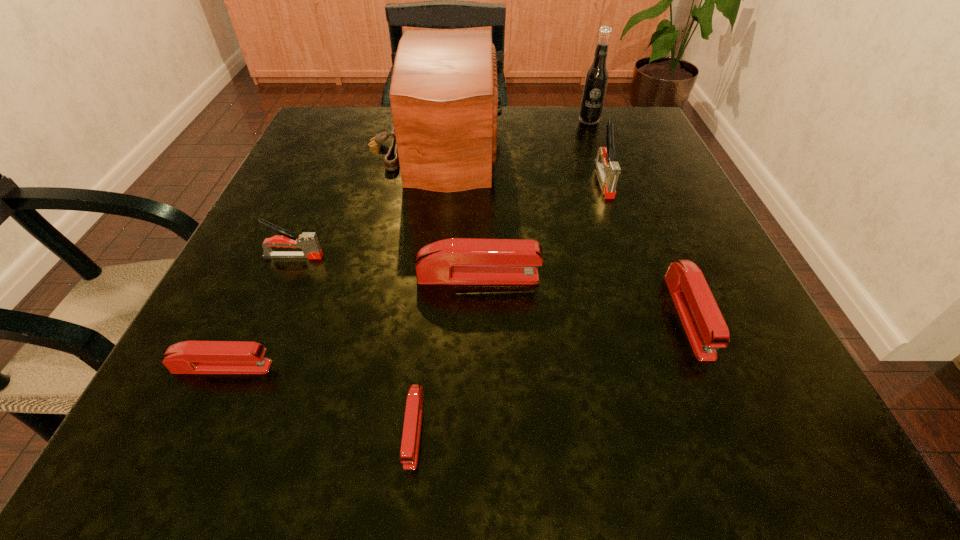
The height and width of the screenshot is (540, 960). Find the location of `vacant space that is in between the leftmost red stapler and the tallest stapler`. vacant space that is in between the leftmost red stapler and the tallest stapler is located at coordinates (413, 273).

Identify which object is the fourth nearest to the root beer. Please provide its 2D coordinates. Your answer should be formatted as a tuple, i.e. [(x, y)], where the tuple contains the x and y coordinates of a point satisfying the conditions above.

[(456, 260)]

This screenshot has height=540, width=960. I want to click on object that ranks as the closest to the radio receiver, so click(x=307, y=241).

Image resolution: width=960 pixels, height=540 pixels. What are the coordinates of `the third closest stapler to the third shortest stapler` in the screenshot? It's located at (409, 451).

Locate which stapler is the third closest to the seventh tallest object. Please provide its 2D coordinates. Your answer should be formatted as a tuple, i.e. [(x, y)], where the tuple contains the x and y coordinates of a point satisfying the conditions above.

[(456, 260)]

Locate an element on the screen. the second closest red stapler to the smaller gray stapler is located at coordinates (189, 357).

Where is `red stapler object that ranks as the closest to the root beer`? The width and height of the screenshot is (960, 540). red stapler object that ranks as the closest to the root beer is located at coordinates (706, 329).

Where is `free location that satisfies the following two spatial constraints: 1. on the handle side of the third tallest object; 2. on the front-facing side of the biggest red stapler`? This screenshot has width=960, height=540. free location that satisfies the following two spatial constraints: 1. on the handle side of the third tallest object; 2. on the front-facing side of the biggest red stapler is located at coordinates (636, 277).

Find the location of a particular element. This screenshot has height=540, width=960. free location that satisfies the following two spatial constraints: 1. on the label of the root beer; 2. on the front-facing side of the biggest red stapler is located at coordinates (646, 277).

Where is `vacant space that satisfies the following two spatial constraints: 1. on the handle side of the third tallest object; 2. on the front-facing side of the biggest red stapler`? This screenshot has height=540, width=960. vacant space that satisfies the following two spatial constraints: 1. on the handle side of the third tallest object; 2. on the front-facing side of the biggest red stapler is located at coordinates (636, 277).